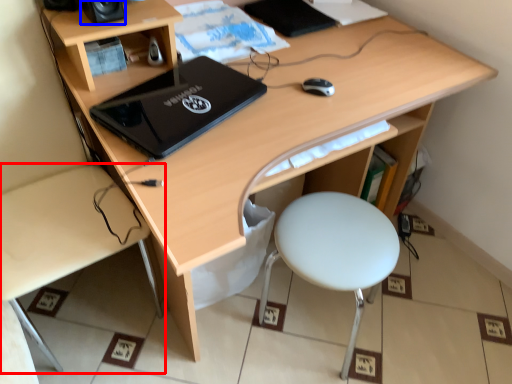
Question: Which object is closer to the camera taking this photo, desk (highlighted by a red box) or speaker (highlighted by a blue box)?

Choices:
 (A) desk
 (B) speaker

Answer: (A)